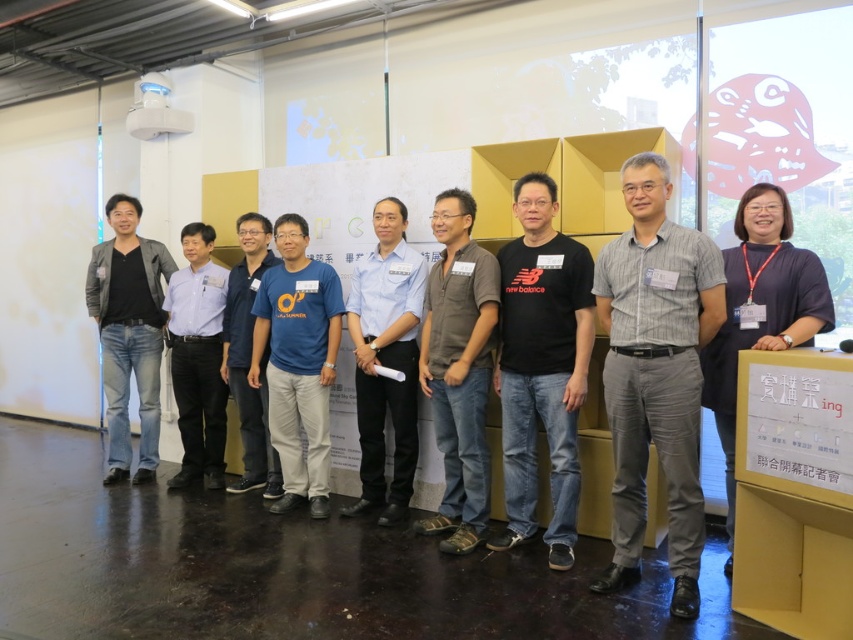
You are standing at the entrance of the room and want to hand a document to the person wearing the brown cotton shirt at center. The document is 2 meters long. Can you reach them without moving closer?

The brown cotton shirt at center is 3.11 meters away from the camera. Since the document is 2 meters long, you cannot reach them without moving closer.